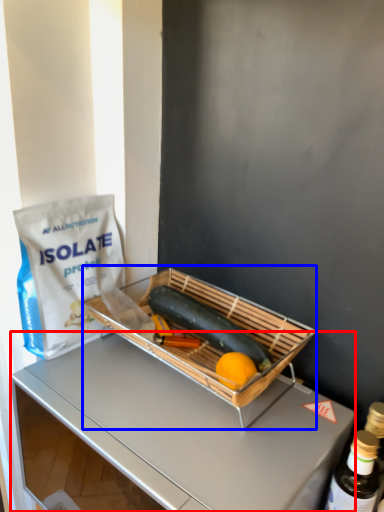
Question: Which object appears farthest to the camera in this image, desk (highlighted by a red box) or appliance (highlighted by a blue box)?

Choices:
 (A) desk
 (B) appliance

Answer: (B)